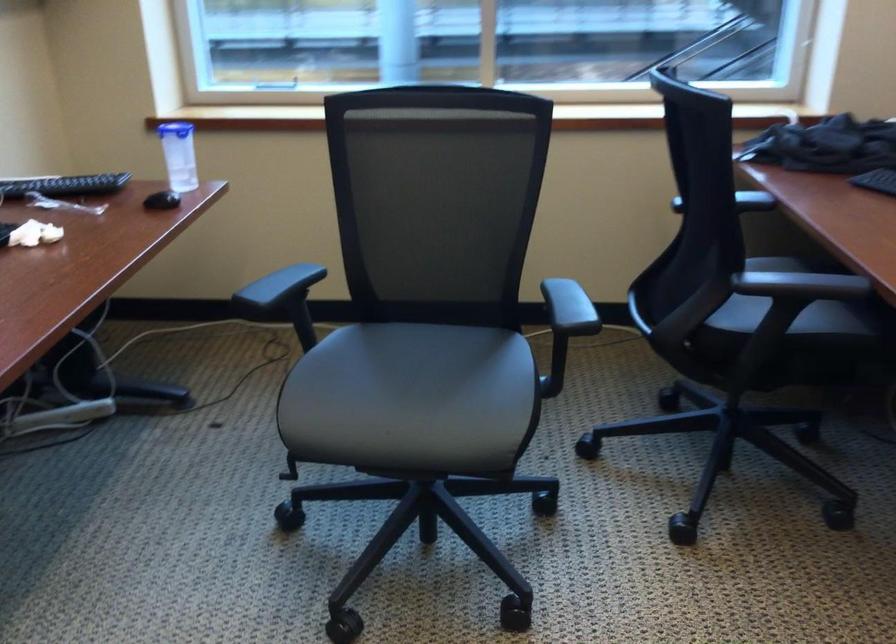
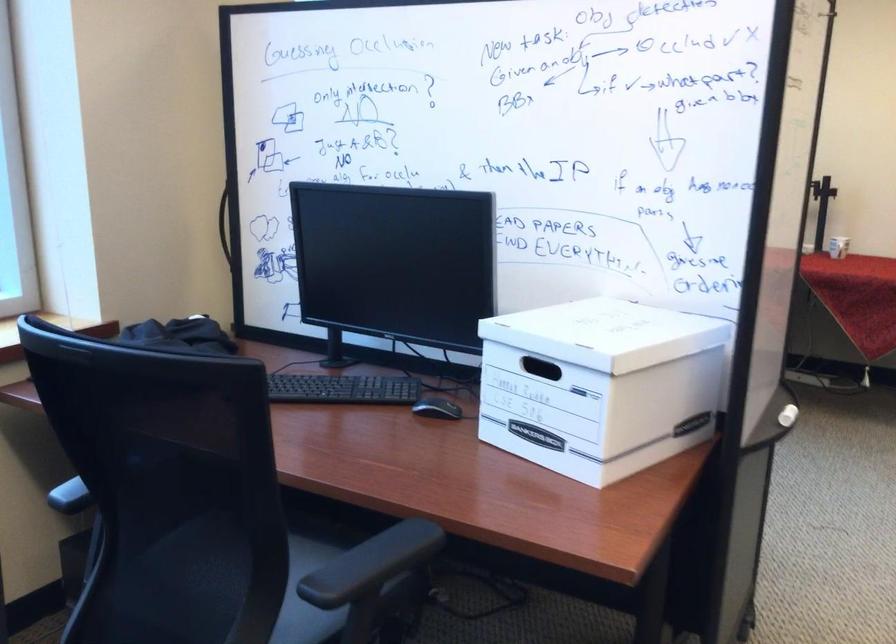
Question: The images are taken continuously from a first-person perspective. In which direction is your viewpoint rotating?

Choices:
 (A) Left
 (B) Right
 (C) Up
 (D) Down

Answer: (B)